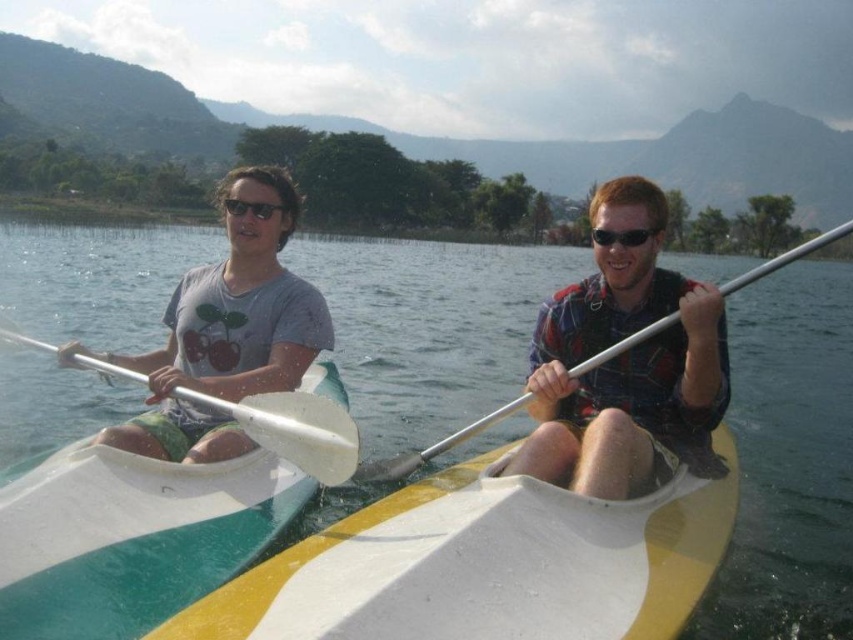
Question: Is white glossy water at center positioned in front of white glossy kayak at left?

Choices:
 (A) yes
 (B) no

Answer: (A)

Question: Which of these objects is positioned closest to the matte gray t-shirt at left?

Choices:
 (A) white glossy water at center
 (B) white glossy kayak at left

Answer: (B)

Question: Which point is farther to the camera?

Choices:
 (A) (242, 632)
 (B) (322, 307)

Answer: (B)

Question: From the image, what is the correct spatial relationship of matte gray t-shirt at left in relation to black plastic sunglasses at upper center?

Choices:
 (A) above
 (B) below

Answer: (B)

Question: Which point is farther to the camera?

Choices:
 (A) matte plaid shirt at center
 (B) white glossy kayak at left
 (C) white glossy water at center
 (D) matte gray t-shirt at left

Answer: (A)

Question: Can you confirm if matte gray t-shirt at left is positioned to the left of white plastic paddle at center?

Choices:
 (A) no
 (B) yes

Answer: (B)